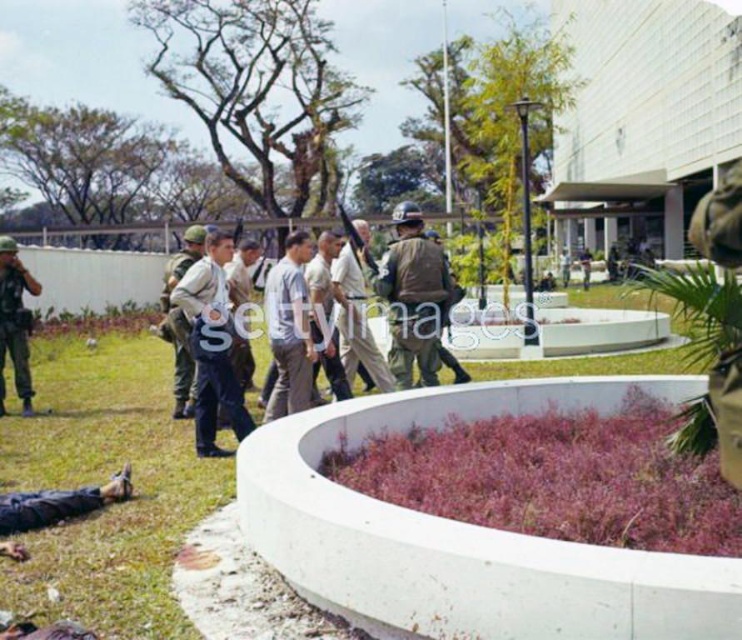
Question: Which is nearer to the camouflage uniform at left?

Choices:
 (A) camouflage uniform at center
 (B) light brown uniform at center
 (C) light gray cotton shirt at center

Answer: (A)

Question: Can you confirm if light brown uniform at center is positioned to the left of camouflage uniform at center?

Choices:
 (A) no
 (B) yes

Answer: (A)

Question: Among these points, which one is farthest from the camera?

Choices:
 (A) (187, 330)
 (B) (355, 252)
 (C) (223, 294)

Answer: (B)

Question: Does light brown uniform at center appear on the left side of camouflage uniform at left?

Choices:
 (A) yes
 (B) no

Answer: (B)

Question: Which object appears closest to the camera in this image?

Choices:
 (A) camouflage fabric uniform at center
 (B) white cotton shirt at center
 (C) light brown uniform at center

Answer: (C)

Question: Can you confirm if light brown uniform at center is positioned below camouflage fabric uniform at center?

Choices:
 (A) yes
 (B) no

Answer: (A)